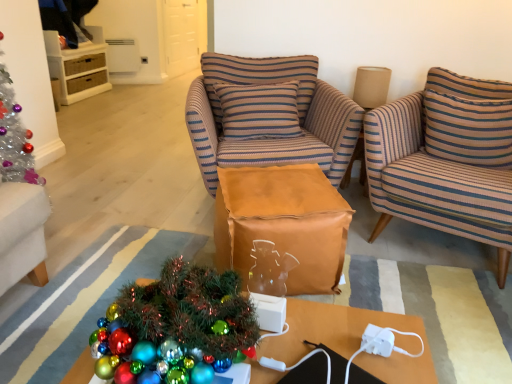
What do you see at coordinates (259, 77) in the screenshot?
I see `striped fabric pillow at center, arranged as the second pillow when viewed from the right` at bounding box center [259, 77].

In order to face striped fabric armchair at right, positioned as the first chair in right-to-left order, should I rotate leftwards or rightwards?

A 25.475 degree turn to the right will do.

Locate an element on the screen. brown paper bag at center is located at coordinates (283, 223).

Describe the element at coordinates (349, 339) in the screenshot. I see `shiny metallic desk at lower center` at that location.

Consider the image. What is the approximate height of striped fabric pillow at upper right, which ranks as the first pillow in right-to-left order?

14.45 inches.

The image size is (512, 384). What do you see at coordinates (78, 66) in the screenshot? I see `white wicker cabinet at upper left` at bounding box center [78, 66].

Find the location of a particular element. This screenshot has height=384, width=512. striped fabric pillow at center, the first pillow from the left is located at coordinates (259, 77).

In the image, is white wicker cabinet at upper left positioned in front of or behind brown paper bag at center?

Clearly, white wicker cabinet at upper left is behind brown paper bag at center.

Could you tell me if white wicker cabinet at upper left is turned towards brown paper bag at center?

No, white wicker cabinet at upper left does not turn towards brown paper bag at center.

From a real-world perspective, between white wicker cabinet at upper left and brown paper bag at center, who is vertically higher?

white wicker cabinet at upper left, from a real-world perspective.

How different are the orientations of white wicker cabinet at upper left and brown paper bag at center in degrees?

The angular difference between white wicker cabinet at upper left and brown paper bag at center is 68.9 degrees.

Is the position of brown paper bag at center less distant than that of striped fabric pillow at upper right, which ranks as the first pillow in right-to-left order?

Yes, it is.

From the picture: Would you say brown paper bag at center is inside or outside striped fabric pillow at upper right, which ranks as the first pillow in right-to-left order?

brown paper bag at center is not inside striped fabric pillow at upper right, which ranks as the first pillow in right-to-left order, it's outside.

Who is bigger, brown paper bag at center or striped fabric pillow at upper right, which ranks as the first pillow in right-to-left order?

With larger size is brown paper bag at center.

Can you confirm if brown paper bag at center is wider than striped fabric pillow at upper right, which ranks as the first pillow in right-to-left order?

Yes.

Could you tell me if striped fabric pillow at upper right, which ranks as the first pillow in right-to-left order, is turned towards shiny metallic ornaments at lower left?

Yes, striped fabric pillow at upper right, which ranks as the first pillow in right-to-left order, is facing shiny metallic ornaments at lower left.

Can you confirm if striped fabric pillow at upper right, the second pillow in the left-to-right sequence, is shorter than shiny metallic ornaments at lower left?

Yes, striped fabric pillow at upper right, the second pillow in the left-to-right sequence, is shorter than shiny metallic ornaments at lower left.

Where is `christmas tree below the striped fabric pillow at upper right, which ranks as the first pillow in right-to-left order (from a real-world perspective)`? The height and width of the screenshot is (384, 512). christmas tree below the striped fabric pillow at upper right, which ranks as the first pillow in right-to-left order (from a real-world perspective) is located at coordinates (177, 328).

Based on the photo, does brown striped armchair at center, the 2th chair in the right-to-left sequence, lie behind striped fabric pillow at upper right, which ranks as the first pillow in right-to-left order?

Yes, it is.

Between brown striped armchair at center, the 2th chair in the right-to-left sequence, and striped fabric pillow at upper right, which ranks as the first pillow in right-to-left order, which one appears on the right side from the viewer's perspective?

From the viewer's perspective, striped fabric pillow at upper right, which ranks as the first pillow in right-to-left order, appears more on the right side.

Can you confirm if brown striped armchair at center, the 2th chair in the right-to-left sequence, is bigger than striped fabric pillow at upper right, which ranks as the first pillow in right-to-left order?

Correct, brown striped armchair at center, the 2th chair in the right-to-left sequence, is larger in size than striped fabric pillow at upper right, which ranks as the first pillow in right-to-left order.

Considering the points (145, 326) and (70, 83), which point is in front, point (145, 326) or point (70, 83)?

The point (145, 326) is closer to the camera.

Considering the relative sizes of shiny metallic ornaments at lower left and white wicker cabinet at upper left in the image provided, is shiny metallic ornaments at lower left taller than white wicker cabinet at upper left?

Incorrect, the height of shiny metallic ornaments at lower left is not larger of that of white wicker cabinet at upper left.

I want to click on cabinetry on the left of shiny metallic ornaments at lower left, so click(x=78, y=66).

How distant is shiny metallic ornaments at lower left from white wicker cabinet at upper left?

A distance of 4.25 meters exists between shiny metallic ornaments at lower left and white wicker cabinet at upper left.

Is brown striped armchair at center, the 1th chair when ordered from left to right, thinner than shiny metallic desk at lower center?

No.

Which is in front, brown striped armchair at center, the 2th chair in the right-to-left sequence, or shiny metallic desk at lower center?

shiny metallic desk at lower center is more forward.

From the image's perspective, who appears lower, brown striped armchair at center, the 2th chair in the right-to-left sequence, or shiny metallic desk at lower center?

From the image's view, shiny metallic desk at lower center is below.

Looking at this image, are brown striped armchair at center, the 1th chair when ordered from left to right, and shiny metallic desk at lower center located far from each other?

That's right, there is a large distance between brown striped armchair at center, the 1th chair when ordered from left to right, and shiny metallic desk at lower center.

Is striped fabric armchair at right, positioned as the first chair in right-to-left order, in front of white wicker cabinet at upper left?

Yes, striped fabric armchair at right, positioned as the first chair in right-to-left order, is closer to the camera.

Does striped fabric armchair at right, placed as the 2th chair when sorted from left to right, turn towards white wicker cabinet at upper left?

No, striped fabric armchair at right, placed as the 2th chair when sorted from left to right, is not turned towards white wicker cabinet at upper left.

Is striped fabric armchair at right, placed as the 2th chair when sorted from left to right, inside or outside of white wicker cabinet at upper left?

striped fabric armchair at right, placed as the 2th chair when sorted from left to right, is spatially situated outside white wicker cabinet at upper left.

Measure the distance between striped fabric armchair at right, placed as the 2th chair when sorted from left to right, and white wicker cabinet at upper left.

The distance of striped fabric armchair at right, placed as the 2th chair when sorted from left to right, from white wicker cabinet at upper left is 3.90 meters.

Locate an element on the screen. This screenshot has width=512, height=384. table that appears in front of the white wicker cabinet at upper left is located at coordinates (283, 223).

Identify the location of pillow that is on the right side of brown paper bag at center. (468, 119).

Estimate the real-world distances between objects in this image. Which object is further from white wicker cabinet at upper left, striped fabric armchair at right, placed as the 2th chair when sorted from left to right, or striped fabric pillow at center, arranged as the second pillow when viewed from the right?

striped fabric armchair at right, placed as the 2th chair when sorted from left to right, is positioned further to the anchor white wicker cabinet at upper left.

Estimate the real-world distances between objects in this image. Which object is further from striped fabric armchair at right, positioned as the first chair in right-to-left order, white wicker cabinet at upper left or brown paper bag at center?

Among the two, white wicker cabinet at upper left is located further to striped fabric armchair at right, positioned as the first chair in right-to-left order.

Considering their positions, is brown paper bag at center positioned closer to shiny metallic desk at lower center than brown striped armchair at center, the 1th chair when ordered from left to right?

brown paper bag at center is closer to shiny metallic desk at lower center.

When comparing their distances from shiny metallic desk at lower center, does striped fabric armchair at right, placed as the 2th chair when sorted from left to right, or brown paper bag at center seem further?

Based on the image, striped fabric armchair at right, placed as the 2th chair when sorted from left to right, appears to be further to shiny metallic desk at lower center.

Estimate the real-world distances between objects in this image. Which object is closer to shiny metallic desk at lower center, shiny metallic ornaments at lower left or brown paper bag at center?

Among the two, shiny metallic ornaments at lower left is located nearer to shiny metallic desk at lower center.

Consider the image. From the image, which object appears to be farther from white wicker cabinet at upper left, striped fabric pillow at center, arranged as the second pillow when viewed from the right, or shiny metallic desk at lower center?

shiny metallic desk at lower center is positioned further to the anchor white wicker cabinet at upper left.

Considering their positions, is brown paper bag at center positioned closer to white wicker cabinet at upper left than brown striped armchair at center, the 1th chair when ordered from left to right?

brown striped armchair at center, the 1th chair when ordered from left to right, is positioned closer to the anchor white wicker cabinet at upper left.

Based on their spatial positions, is striped fabric pillow at center, the first pillow from the left, or striped fabric armchair at right, positioned as the first chair in right-to-left order, closer to shiny metallic desk at lower center?

striped fabric armchair at right, positioned as the first chair in right-to-left order, lies closer to shiny metallic desk at lower center than the other object.

Identify the location of table between shiny metallic desk at lower center and striped fabric pillow at upper right, which ranks as the first pillow in right-to-left order, from left to right. The height and width of the screenshot is (384, 512). (283, 223).

Identify the location of chair between striped fabric pillow at center, arranged as the second pillow when viewed from the right, and striped fabric armchair at right, placed as the 2th chair when sorted from left to right, in the horizontal direction. (269, 116).

Where is `pillow between shiny metallic desk at lower center and striped fabric pillow at center, arranged as the second pillow when viewed from the right, in the front-back direction`? The image size is (512, 384). pillow between shiny metallic desk at lower center and striped fabric pillow at center, arranged as the second pillow when viewed from the right, in the front-back direction is located at coordinates (468, 119).

Where is `table between shiny metallic ornaments at lower left and white wicker cabinet at upper left from front to back`? This screenshot has width=512, height=384. table between shiny metallic ornaments at lower left and white wicker cabinet at upper left from front to back is located at coordinates (283, 223).